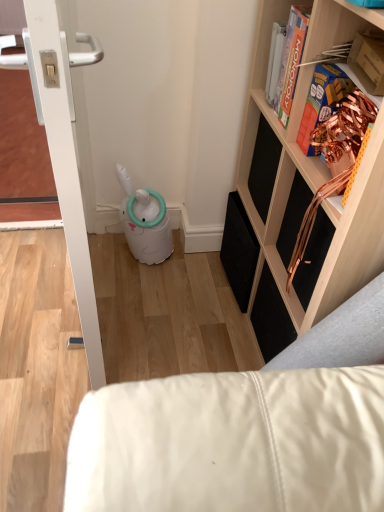
Question: Is white leather couch at lower right beside white glossy door at left?

Choices:
 (A) yes
 (B) no

Answer: (B)

Question: From a real-world perspective, is white leather couch at lower right positioned over white glossy door at left based on gravity?

Choices:
 (A) yes
 (B) no

Answer: (B)

Question: Is white leather couch at lower right positioned with its back to white glossy door at left?

Choices:
 (A) yes
 (B) no

Answer: (B)

Question: Is white leather couch at lower right to the left of white glossy door at left from the viewer's perspective?

Choices:
 (A) yes
 (B) no

Answer: (B)

Question: Is white leather couch at lower right closer to the viewer compared to white glossy door at left?

Choices:
 (A) no
 (B) yes

Answer: (A)

Question: Is orange matte monopoly board game at upper right, placed as the 2th book when sorted from front to back, taller or shorter than copper foil book at upper right, arranged as the first book when ordered from the bottom?

Choices:
 (A) short
 (B) tall

Answer: (B)

Question: From the image's perspective, is orange matte monopoly board game at upper right, placed as the 2th book when sorted from front to back, positioned above or below copper foil book at upper right, the first book viewed from the front?

Choices:
 (A) below
 (B) above

Answer: (B)

Question: Relative to copper foil book at upper right, which is the 2th book in top-to-bottom order, is orange matte monopoly board game at upper right, which is the second book from bottom to top, in front or behind?

Choices:
 (A) behind
 (B) front

Answer: (A)

Question: Considering the positions of point (292, 72) and point (327, 65), is point (292, 72) closer or farther from the camera than point (327, 65)?

Choices:
 (A) closer
 (B) farther

Answer: (B)

Question: From a real-world perspective, is white leather couch at lower right positioned above or below copper foil book at upper right, arranged as the first book when ordered from the bottom?

Choices:
 (A) below
 (B) above

Answer: (A)

Question: Is point (119, 489) positioned closer to the camera than point (345, 87)?

Choices:
 (A) closer
 (B) farther

Answer: (A)

Question: Considering the relative positions of white leather couch at lower right and copper foil book at upper right, arranged as the first book when ordered from the bottom, in the image provided, is white leather couch at lower right to the left or to the right of copper foil book at upper right, arranged as the first book when ordered from the bottom,?

Choices:
 (A) right
 (B) left

Answer: (B)

Question: From the image's perspective, is white leather couch at lower right above or below copper foil book at upper right, which is the 2th book in top-to-bottom order?

Choices:
 (A) below
 (B) above

Answer: (A)

Question: Considering the relative positions of white leather couch at lower right and orange matte monopoly board game at upper right, which appears as the 1th book when viewed from the back, in the image provided, is white leather couch at lower right to the left or to the right of orange matte monopoly board game at upper right, which appears as the 1th book when viewed from the back,?

Choices:
 (A) left
 (B) right

Answer: (A)

Question: Looking at their shapes, would you say white leather couch at lower right is wider or thinner than orange matte monopoly board game at upper right, which is the second book from bottom to top?

Choices:
 (A) wide
 (B) thin

Answer: (A)